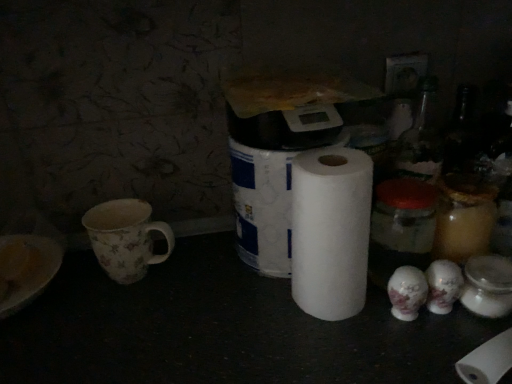
Question: Is white matte paper towel at center next to floral-patterned ceramic mug at left?

Choices:
 (A) yes
 (B) no

Answer: (B)

Question: Does white matte paper towel at center appear on the left side of floral-patterned ceramic mug at left?

Choices:
 (A) yes
 (B) no

Answer: (B)

Question: Is white matte paper towel at center looking in the opposite direction of floral-patterned ceramic mug at left?

Choices:
 (A) yes
 (B) no

Answer: (B)

Question: Is white matte paper towel at center taller than floral-patterned ceramic mug at left?

Choices:
 (A) no
 (B) yes

Answer: (B)

Question: Considering the relative sizes of white matte paper towel at center and floral-patterned ceramic mug at left in the image provided, is white matte paper towel at center shorter than floral-patterned ceramic mug at left?

Choices:
 (A) no
 (B) yes

Answer: (A)

Question: Is white matte paper towel at center facing towards floral-patterned ceramic mug at left?

Choices:
 (A) no
 (B) yes

Answer: (A)

Question: Would you say floral-patterned ceramic mug at left contains white matte toilet paper at center?

Choices:
 (A) no
 (B) yes

Answer: (A)

Question: Is floral-patterned ceramic mug at left further to camera compared to white matte toilet paper at center?

Choices:
 (A) yes
 (B) no

Answer: (A)

Question: Is floral-patterned ceramic mug at left outside of white matte toilet paper at center?

Choices:
 (A) no
 (B) yes

Answer: (B)

Question: Can you confirm if floral-patterned ceramic mug at left is positioned to the right of white matte toilet paper at center?

Choices:
 (A) no
 (B) yes

Answer: (A)

Question: Are floral-patterned ceramic mug at left and white matte toilet paper at center far apart?

Choices:
 (A) no
 (B) yes

Answer: (A)

Question: Considering the relative sizes of floral-patterned ceramic mug at left and white matte toilet paper at center in the image provided, is floral-patterned ceramic mug at left bigger than white matte toilet paper at center?

Choices:
 (A) no
 (B) yes

Answer: (A)

Question: Does white matte paper towel at center have a smaller size compared to white matte toilet paper at center?

Choices:
 (A) no
 (B) yes

Answer: (B)